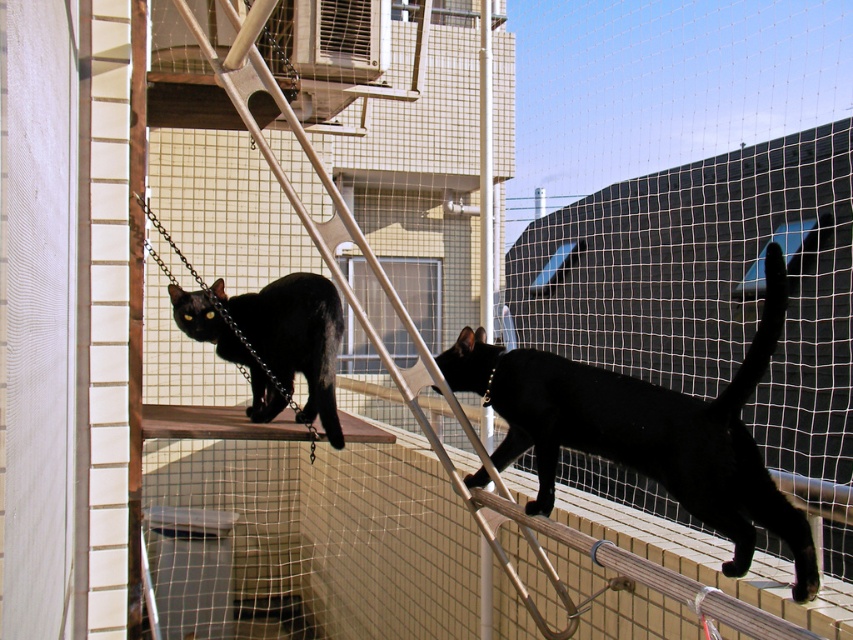
Question: Which of the following is the farthest from the observer?

Choices:
 (A) (630, 387)
 (B) (200, 312)

Answer: (B)

Question: Among these objects, which one is nearest to the camera?

Choices:
 (A) black glossy cat at upper right
 (B) matte black cat at upper left

Answer: (A)

Question: Is black glossy cat at upper right to the right of matte black cat at upper left from the viewer's perspective?

Choices:
 (A) no
 (B) yes

Answer: (B)

Question: Among these objects, which one is farthest from the camera?

Choices:
 (A) black glossy cat at upper right
 (B) matte black cat at upper left

Answer: (B)

Question: Does black glossy cat at upper right appear over matte black cat at upper left?

Choices:
 (A) yes
 (B) no

Answer: (B)

Question: From the image, what is the correct spatial relationship of black glossy cat at upper right in relation to matte black cat at upper left?

Choices:
 (A) below
 (B) above

Answer: (A)